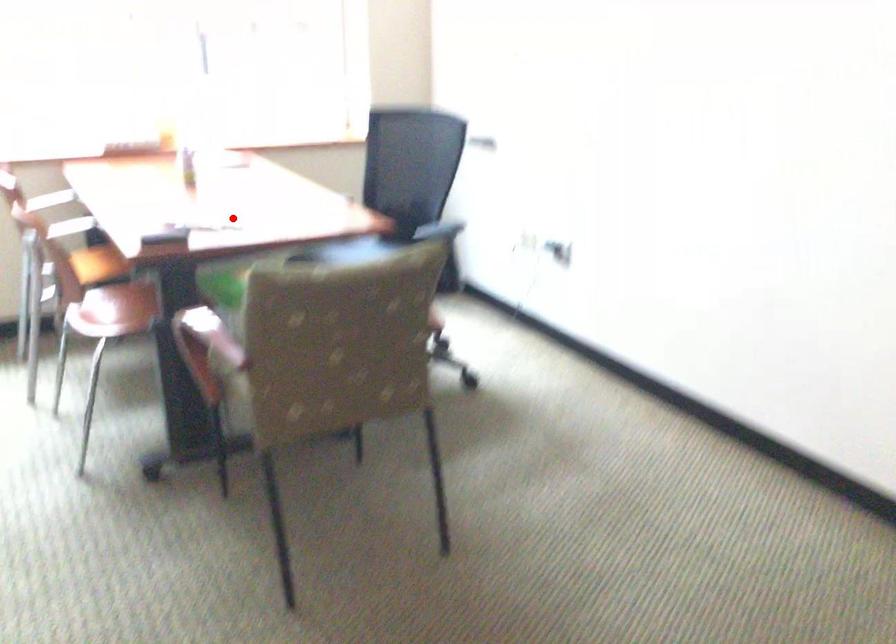
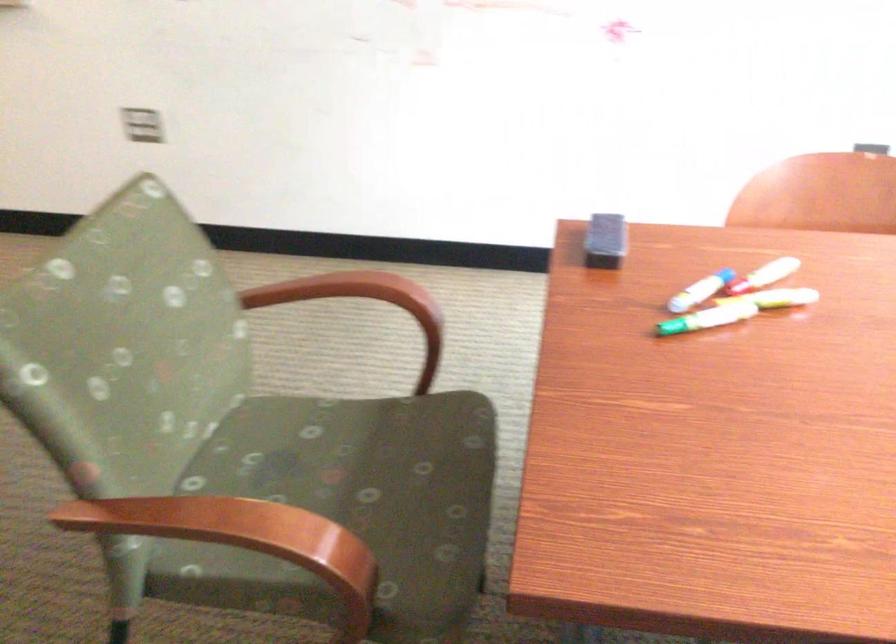
Question: A red point is marked in image1. In image2, is the corresponding 3D point closer to the camera or farther? Reply with the corresponding letter.

Choices:
 (A) The corresponding 3D point is closer.
 (B) The corresponding 3D point is farther.

Answer: (A)